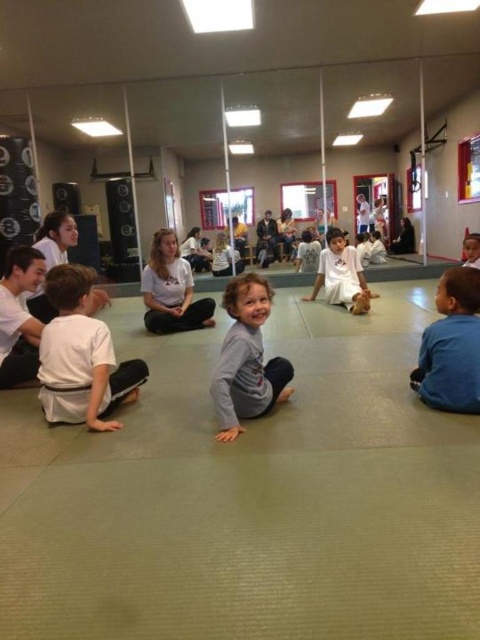
Looking at this image, can you confirm if white karate uniform at lower left is wider than gray soft shirt at center?

Yes.

Is point (113, 355) farther from camera compared to point (232, 326)?

Yes, point (113, 355) is behind point (232, 326).

What do you see at coordinates (81, 356) in the screenshot?
I see `white karate uniform at lower left` at bounding box center [81, 356].

This screenshot has width=480, height=640. Find the location of `white karate uniform at lower left`. white karate uniform at lower left is located at coordinates (81, 356).

Which is more to the left, blue cotton shirt at lower right or white cotton shirt at center?

white cotton shirt at center is more to the left.

Is point (471, 316) closer to viewer compared to point (199, 305)?

Yes, point (471, 316) is closer to viewer.

Identify the location of blue cotton shirt at lower right. (452, 346).

Who is more forward, (68, 316) or (445, 330)?

Point (445, 330)

Does white karate uniform at lower left have a greater height compared to blue cotton shirt at lower right?

Correct, white karate uniform at lower left is much taller as blue cotton shirt at lower right.

Between point (46, 413) and point (479, 365), which one is positioned behind?

Point (46, 413)

Where is `white karate uniform at lower left`? This screenshot has height=640, width=480. white karate uniform at lower left is located at coordinates (81, 356).